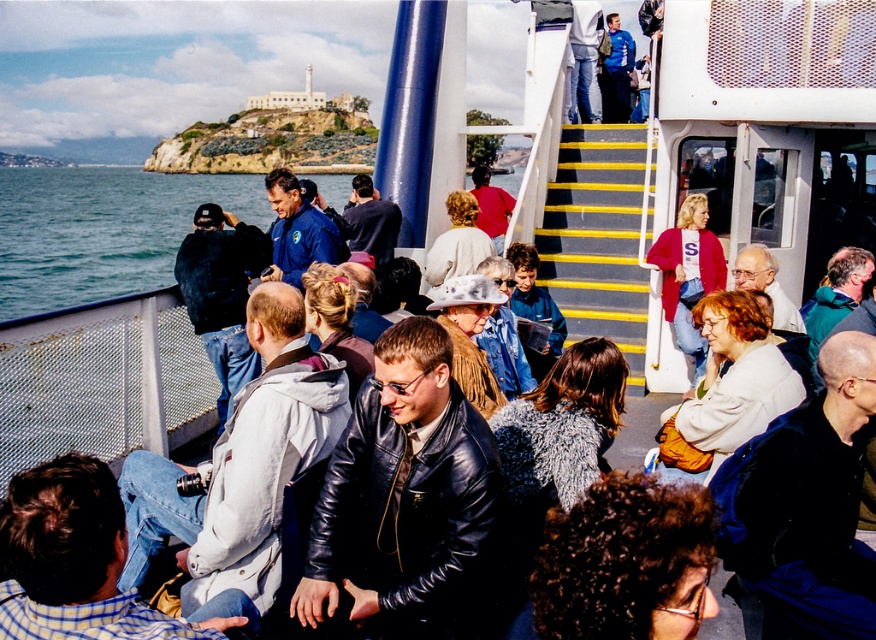
You are a photographer trying to capture a candid shot of the ferry passengers. You notice the dark blue leather jacket at lower right and the green fabric jacket at center. Which jacket should you focus on if you want to capture the one that takes up more visual space in the frame?

The dark blue leather jacket at lower right is larger in size than the green fabric jacket at center, so focusing on it would capture the jacket that takes up more visual space in the frame.

You are standing on the ferry deck and want to locate the shiny black leather jacket at center. Which coordinates should you look at?

You should look at coordinates point [406,497] to find the shiny black leather jacket at center.